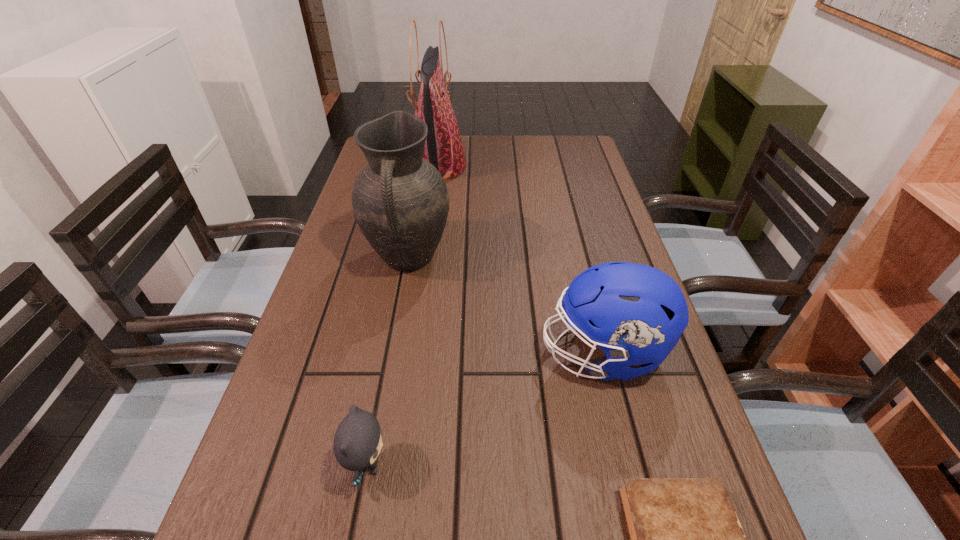
This screenshot has height=540, width=960. What are the coordinates of `vacant space at the left edge of the desktop` in the screenshot? It's located at (324, 444).

At what (x,y) coordinates should I click in order to perform the action: click on free location at the right edge. Please return your answer as a coordinate pair (x, y). This screenshot has height=540, width=960. Looking at the image, I should click on [615, 403].

This screenshot has width=960, height=540. Identify the location of vacant space at the far right corner of the desktop. (571, 159).

Find the location of `free point between the kitten and the handbag`. free point between the kitten and the handbag is located at coordinates (402, 315).

In order to click on free space between the kitten and the tallest object in this screenshot , I will do `click(402, 315)`.

Identify the location of vacant space that's between the pitcher and the kitten. tap(388, 362).

The height and width of the screenshot is (540, 960). I want to click on free point between the third shortest object and the farthest object, so click(x=520, y=260).

At what (x,y) coordinates should I click in order to perform the action: click on free spot between the kitten and the third shortest object. Please return your answer as a coordinate pair (x, y). This screenshot has height=540, width=960. Looking at the image, I should click on (485, 409).

The width and height of the screenshot is (960, 540). I want to click on the closest object relative to the pitcher, so click(x=443, y=148).

Locate which object is the second closest to the diary. Please provide its 2D coordinates. Your answer should be formatted as a tuple, i.e. [(x, y)], where the tuple contains the x and y coordinates of a point satisfying the conditions above.

[(357, 442)]